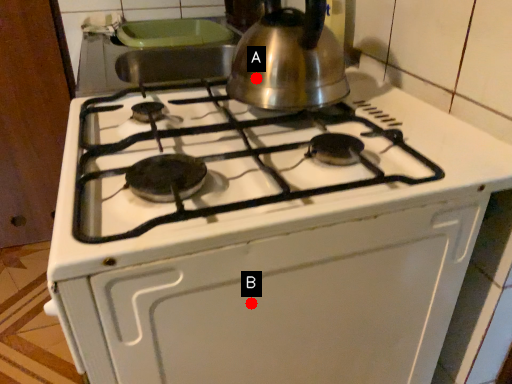
Question: Two points are circled on the image, labeled by A and B beside each circle. Which point is closer to the camera?

Choices:
 (A) A is closer
 (B) B is closer

Answer: (B)